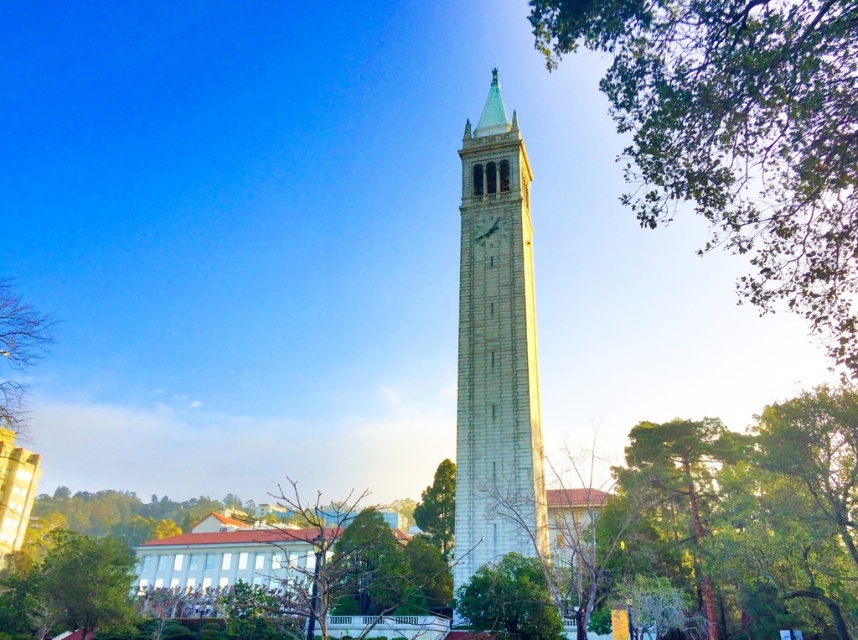
Is white stone clock tower at center thinner than green leafy tree at lower center?

No, white stone clock tower at center is not thinner than green leafy tree at lower center.

Is white stone clock tower at center wider than green leafy tree at lower center?

Yes.

Is point (478, 442) closer to camera compared to point (512, 584)?

No, (478, 442) is further to viewer.

You are a GUI agent. You are given a task and a screenshot of the screen. Output one action in this format:
    pyautogui.click(x=<x>, y=<y>)
    Task: Click on the white stone clock tower at center
    The image size is (858, 640).
    Given the screenshot: What is the action you would take?
    pyautogui.click(x=496, y=352)

Measure the distance from green leafy tree at lower center to green leafy tree at center.

green leafy tree at lower center and green leafy tree at center are 31.33 meters apart.

Which is in front, point (464, 582) or point (437, 544)?

Point (464, 582)

What do you see at coordinates (509, 600) in the screenshot?
I see `green leafy tree at lower center` at bounding box center [509, 600].

Identify the location of green leafy tree at lower center. Image resolution: width=858 pixels, height=640 pixels. [x=509, y=600].

Can you confirm if white stone clock tower at center is bigger than bare branches at left?

Correct, white stone clock tower at center is larger in size than bare branches at left.

Does white stone clock tower at center appear on the right side of bare branches at left?

Correct, you'll find white stone clock tower at center to the right of bare branches at left.

Is point (506, 496) positioned before point (35, 340)?

Yes, it is.

You are a GUI agent. You are given a task and a screenshot of the screen. Output one action in this format:
    pyautogui.click(x=<x>, y=<y>)
    Task: Click on the white stone clock tower at center
    
    Given the screenshot: What is the action you would take?
    pyautogui.click(x=496, y=352)